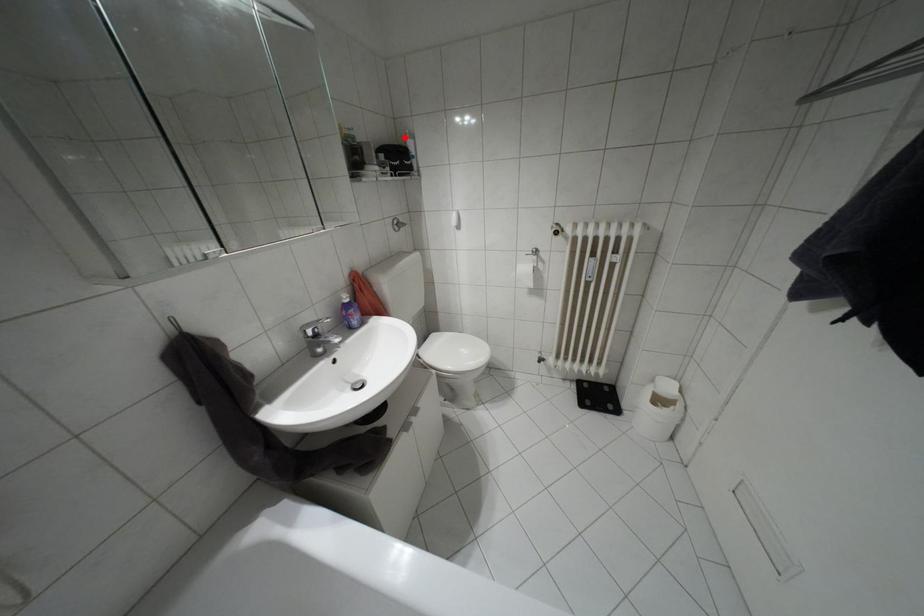
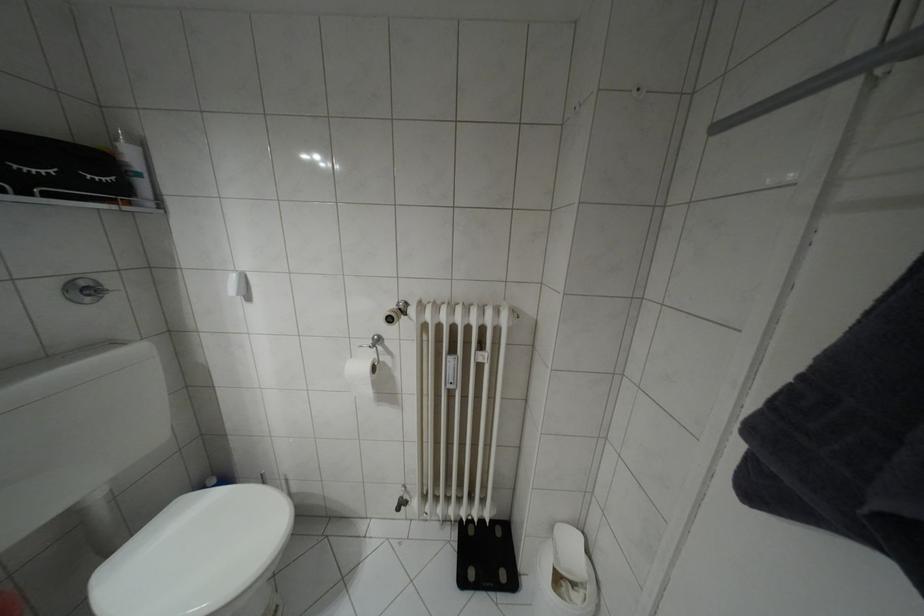
Question: I am providing you with two images of the same scene from different viewpoints. Given a red point in image1, look at the same physical point in image2. Is it:

Choices:
 (A) Closer to the viewpoint
 (B) Farther from the viewpoint

Answer: (B)